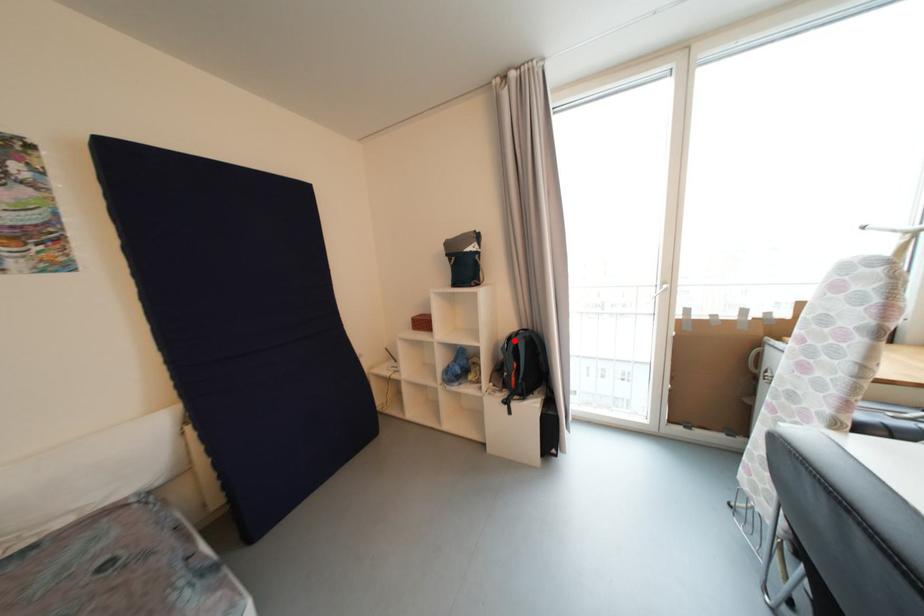
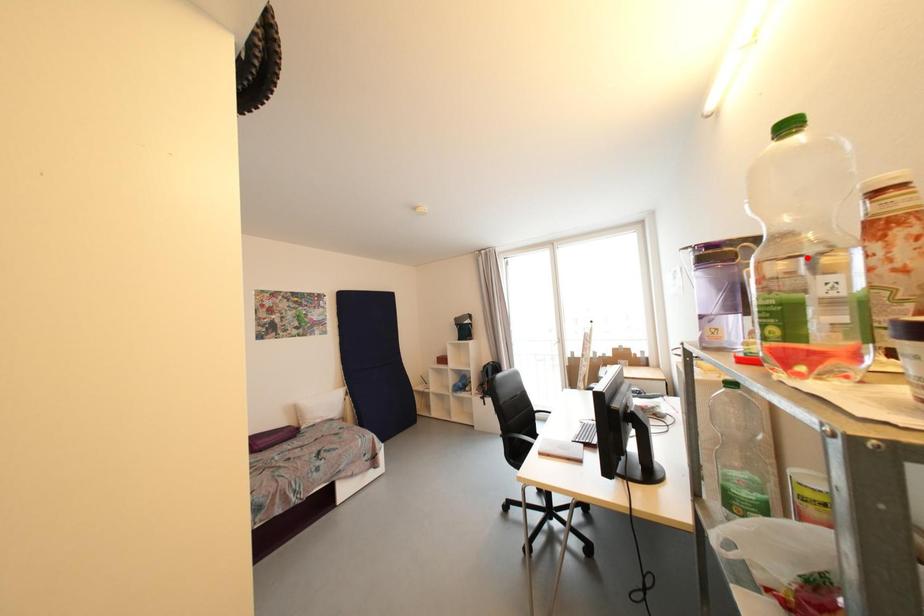
I am providing you with two images of the same scene from different viewpoints. A red point is marked on the first image and another point is marked on the second image. Is the red point in image1 aligned with the point shown in image2?

No